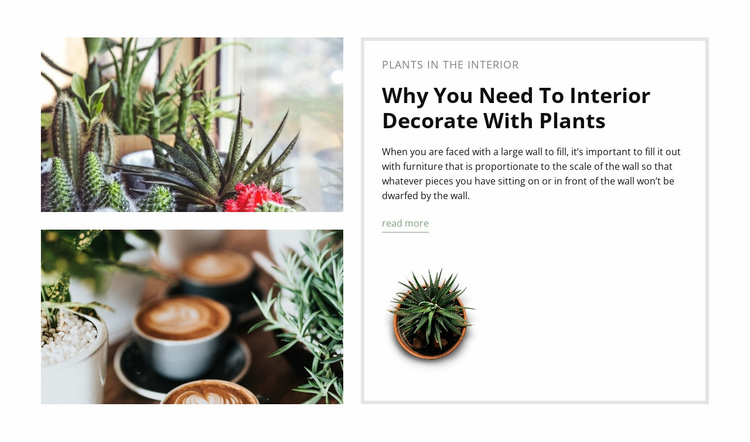
Locate an element on the screen. window is located at coordinates (301, 89), (154, 67).